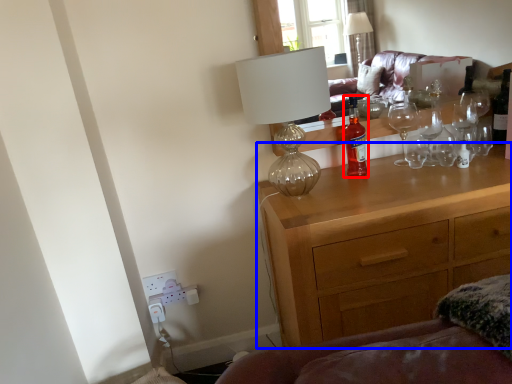
Question: Which of the following is the closest to the observer, bottle (highlighted by a red box) or chest of drawers (highlighted by a blue box)?

Choices:
 (A) bottle
 (B) chest of drawers

Answer: (B)